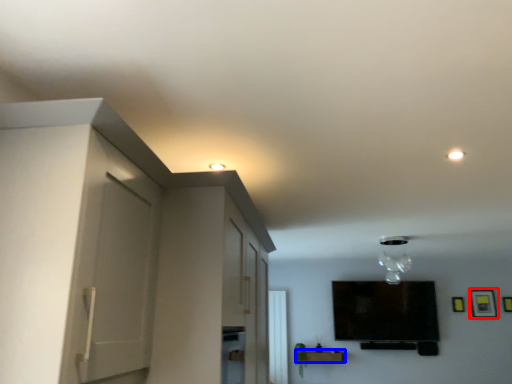
Question: Which object is closer to the camera taking this photo, picture frame (highlighted by a red box) or furniture (highlighted by a blue box)?

Choices:
 (A) picture frame
 (B) furniture

Answer: (B)